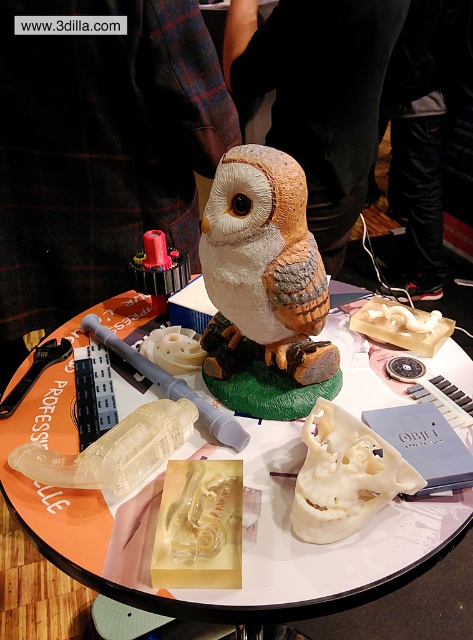
You are a visitor at the technology event and want to examine the translucent plastic skull at center and the matte clay owl at center. Which object can you see in more detail without moving your head?

The translucent plastic skull at center is closer to the viewer than the matte clay owl at center, so you can see the translucent plastic skull at center in more detail without moving your head.

You are a judge at a 3D printing competition. You need to determine which object is taller between the translucent plastic skull at center and the matte clay owl at center. Based on the provided description, which one is taller?

The translucent plastic skull at center is taller than the matte clay owl at center according to the description.

You are a photographer standing at a distance of 20 inches from the display table. You want to take a closeup photo of the translucent plastic skull at center without moving closer. Can you reach it with your camera lens?

The translucent plastic skull at center is 21.66 inches away from the viewer, which is slightly further than your current position of 20 inches. Therefore, you cannot reach it without moving closer.